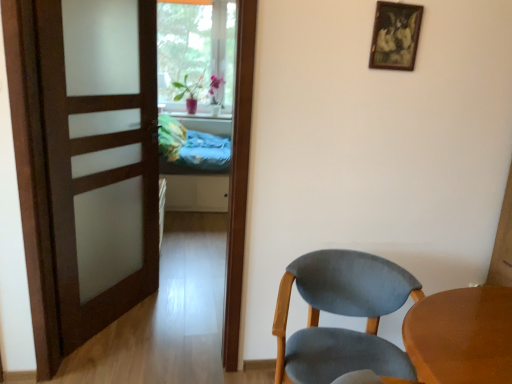
I want to click on vacant space underneath satin wood door at left (from a real-world perspective), so click(105, 329).